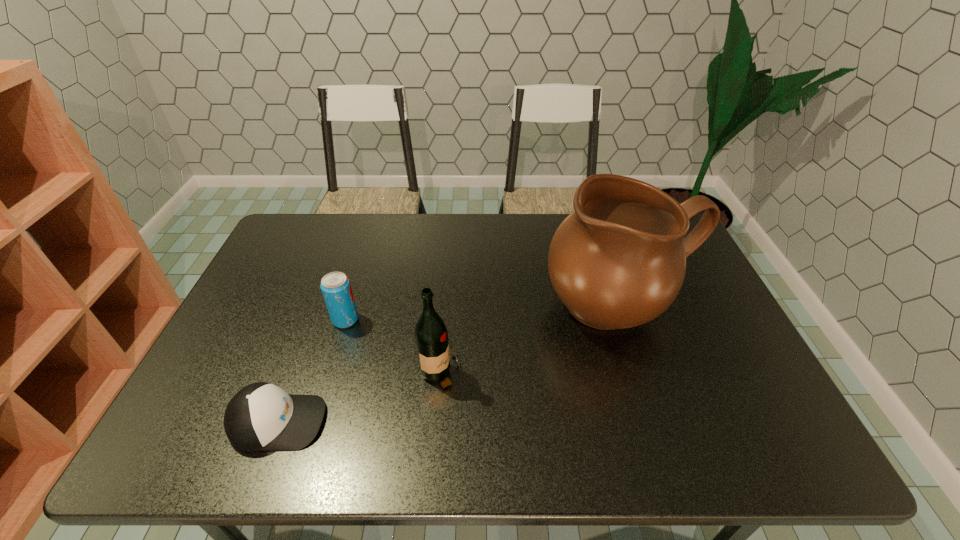
Locate an element on the screen. This screenshot has width=960, height=540. free space located on the front panel of the nearest object is located at coordinates (381, 422).

At what (x,y) coordinates should I click in order to perform the action: click on object situated at the near edge. Please return your answer as a coordinate pair (x, y). Looking at the image, I should click on (261, 416).

You are a GUI agent. You are given a task and a screenshot of the screen. Output one action in this format:
    pyautogui.click(x=<x>, y=<y>)
    Task: Click on the object that is at the left edge
    This screenshot has height=540, width=960.
    Given the screenshot: What is the action you would take?
    pyautogui.click(x=261, y=416)

Where is `object at the right edge`? Image resolution: width=960 pixels, height=540 pixels. object at the right edge is located at coordinates (618, 261).

Where is `object at the near left corner`? object at the near left corner is located at coordinates (261, 416).

Locate an element on the screen. The width and height of the screenshot is (960, 540). vacant space at the far edge of the desktop is located at coordinates (491, 247).

In the image, there is a desktop. At what (x,y) coordinates should I click in order to perform the action: click on free space at the near edge. Please return your answer as a coordinate pair (x, y). The width and height of the screenshot is (960, 540). Looking at the image, I should click on (607, 436).

Locate an element on the screen. The image size is (960, 540). vacant region at the left edge of the desktop is located at coordinates (243, 317).

This screenshot has width=960, height=540. In the image, there is a desktop. Find the location of `vacant space at the right edge`. vacant space at the right edge is located at coordinates (775, 403).

The height and width of the screenshot is (540, 960). What are the coordinates of `vacant space at the far left corner of the desktop` in the screenshot? It's located at (305, 239).